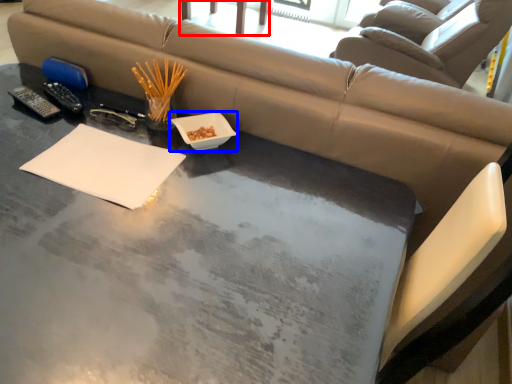
Question: Which object appears farthest to the camera in this image, chair (highlighted by a red box) or bowl (highlighted by a blue box)?

Choices:
 (A) chair
 (B) bowl

Answer: (A)